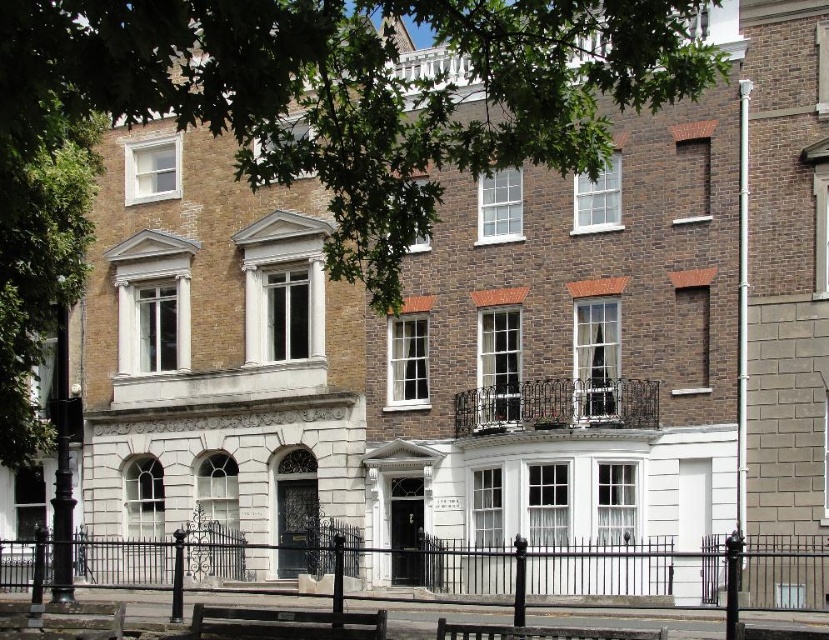
Is point (602, 545) less distant than point (651, 637)?

No.

Is black wrought iron fence at lower center smaller than wooden park bench at center?

No.

Is point (109, 582) farther from camera compared to point (471, 628)?

Yes, it is behind point (471, 628).

Image resolution: width=829 pixels, height=640 pixels. I want to click on black wrought iron fence at lower center, so click(623, 568).

Looking at this image, measure the distance from green leafy tree at upper center to black wrought iron fence at lower center.

44.45 feet

Does green leafy tree at upper center have a lesser width compared to black wrought iron fence at lower center?

Indeed, green leafy tree at upper center has a lesser width compared to black wrought iron fence at lower center.

At what (x,y) coordinates should I click in order to perform the action: click on green leafy tree at upper center. Please return your answer as a coordinate pair (x, y). This screenshot has width=829, height=640. Looking at the image, I should click on (335, 99).

The image size is (829, 640). Identify the location of green leafy tree at upper center. (335, 99).